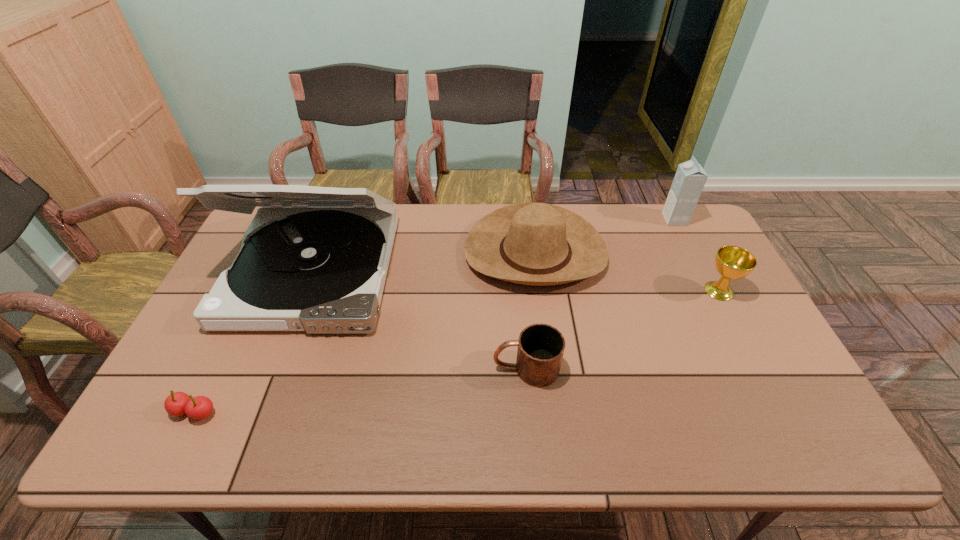
What are the coordinates of `cowboy hat present at the far edge` in the screenshot? It's located at (538, 244).

Identify the location of object that is at the near edge. (178, 403).

At what (x,y) coordinates should I click in order to perform the action: click on CD player positioned at the left edge. Please return your answer as a coordinate pair (x, y). The width and height of the screenshot is (960, 540). Looking at the image, I should click on (315, 259).

I want to click on cherry that is at the left edge, so click(x=178, y=403).

You are a GUI agent. You are given a task and a screenshot of the screen. Output one action in this format:
    pyautogui.click(x=<x>, y=<y>)
    Task: Click on the carton positioned at the right edge
    This screenshot has height=540, width=960.
    Given the screenshot: What is the action you would take?
    pyautogui.click(x=690, y=178)

In order to click on chalice located at the right edge in this screenshot , I will do `click(732, 262)`.

Identify the location of object positioned at the far left corner. (315, 259).

This screenshot has width=960, height=540. What are the coordinates of `object present at the near left corner` in the screenshot? It's located at (178, 403).

Where is `object that is at the far right corner`? object that is at the far right corner is located at coordinates (690, 178).

Identify the location of vacant space at the near edge of the desktop. This screenshot has width=960, height=540. (335, 444).